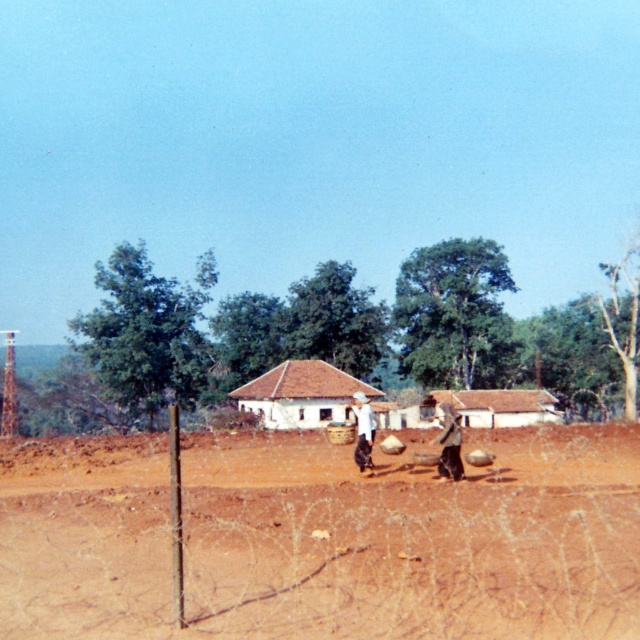
You are standing at the point marked as point (380, 401) in the image. What object is exactly at that location?

The white clay house at center is exactly at point (380, 401).

You are a traveler who wants to take shelter from the rain. You see the brown clay hut at center and the brown corrugated metal hut at center. Which one would provide better protection against the rain?

The brown clay hut at center has a larger size compared to the brown corrugated metal hut at center, so it might provide better protection against the rain due to its size.